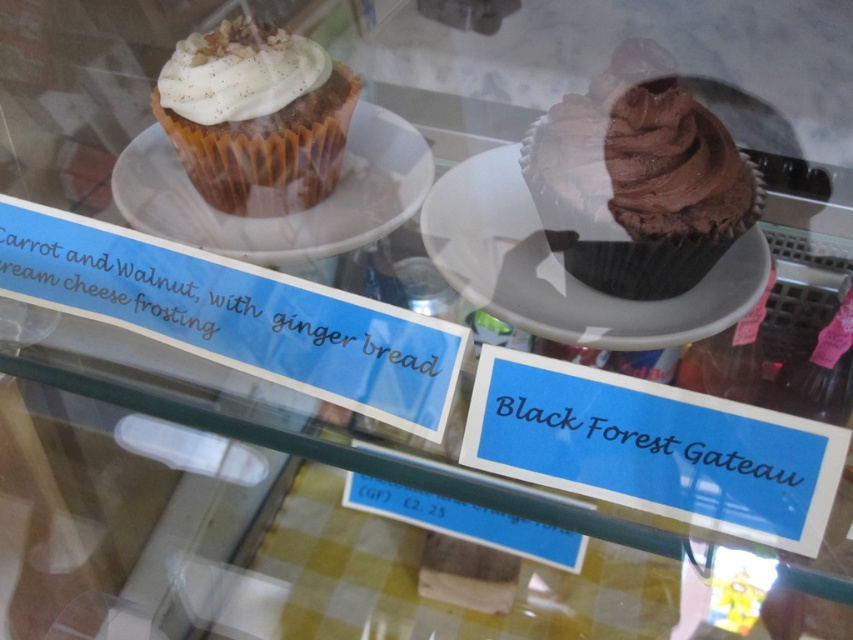
Question: Does chocolate matte cupcake at right have a smaller size compared to white paper plate at upper left?

Choices:
 (A) yes
 (B) no

Answer: (A)

Question: Is matte brown cupcake at upper left below white cream at upper left?

Choices:
 (A) yes
 (B) no

Answer: (A)

Question: Which point is closer to the camera?

Choices:
 (A) white cream at upper left
 (B) chocolate matte cupcake at right

Answer: (B)

Question: Among these points, which one is nearest to the camera?

Choices:
 (A) (274, 204)
 (B) (546, 179)
 (C) (207, 122)
 (D) (648, 326)

Answer: (B)

Question: Which point is farther to the camera?

Choices:
 (A) white paper plate at upper left
 (B) matte brown cupcake at upper left

Answer: (A)

Question: Is chocolate matte cupcake at right below matte brown cupcake at upper left?

Choices:
 (A) yes
 (B) no

Answer: (A)